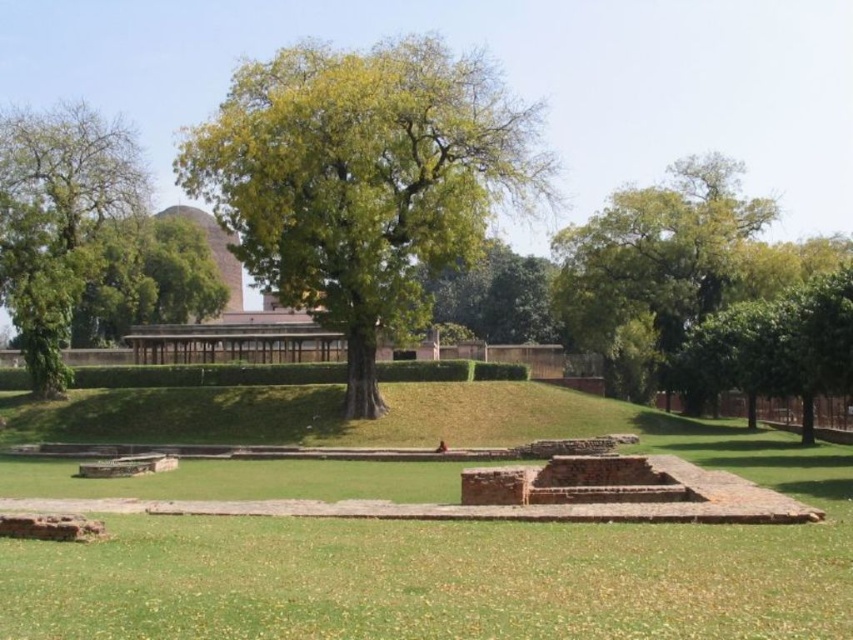
You are standing in the historical site and want to take a photo of both the green leafy tree at center and the green leafy tree at upper right. Which tree should you focus on first to ensure both are in the frame?

You should focus on the green leafy tree at center first because it is closer to you than the green leafy tree at upper right, so adjusting the camera to include both would require framing from the closer one outward.

You are standing at the origin point of the coordinate system. You want to walk to the green grass at center. Which direction should you walk?

The green grass at center is located at coordinate point 0.864 on the x axis and 0.549 on the y axis, so you should walk northeast to reach it.

You are standing at the edge of the grassy area and want to take a photo of the green leafy tree at center. To ensure the tree is fully visible in your photo, should you move closer to or further away from the green grass at center?

The green grass at center is in front of the green leafy tree at center. To ensure the tree is fully visible, you should move further away from the green grass at center so that the grass doesn not block the view of the tree.